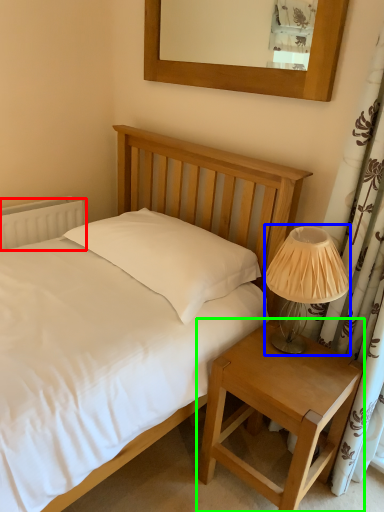
Question: Considering the real-world distances, which object is closest to radiator (highlighted by a red box)? table lamp (highlighted by a blue box) or nightstand (highlighted by a green box).

Choices:
 (A) table lamp
 (B) nightstand

Answer: (A)